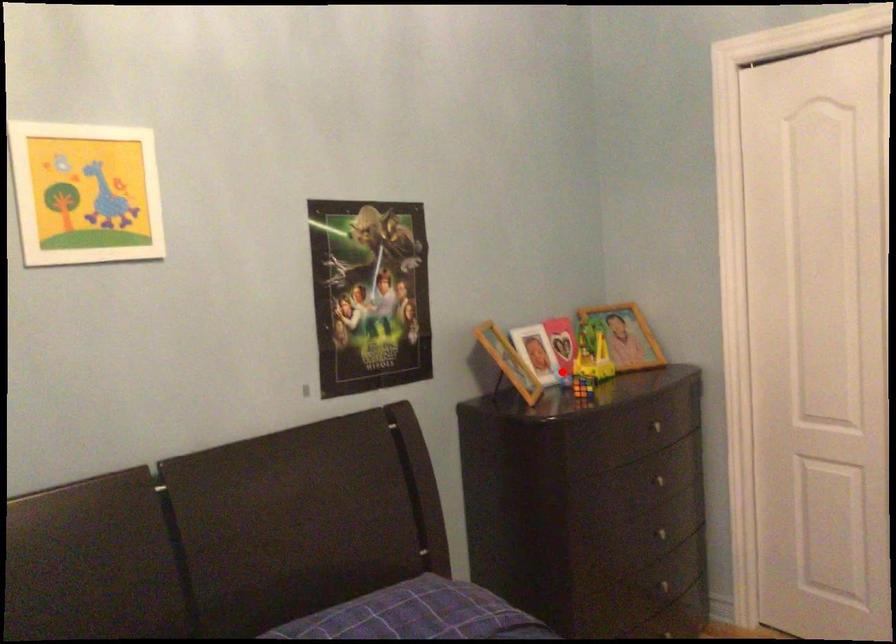
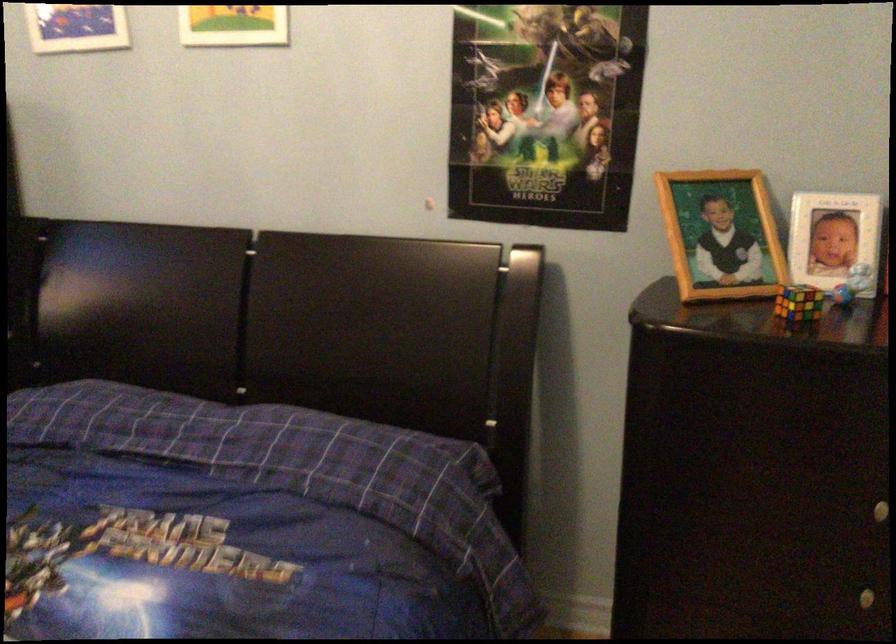
Locate, in the second image, the point that corresponds to the highlighted location in the first image.

(851, 283)